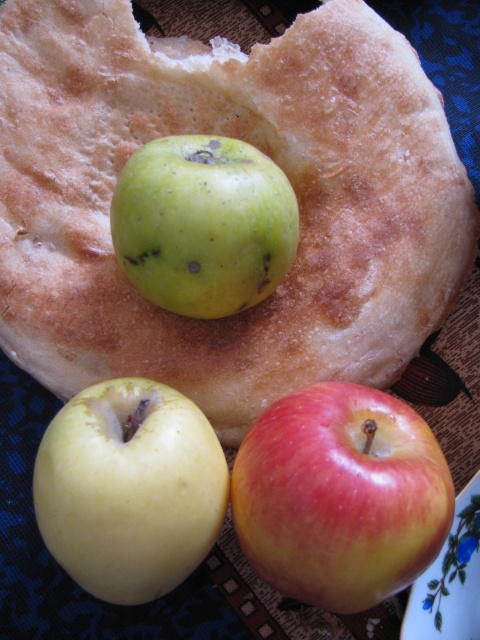
You are arranging fruits on a table and notice two green matte apples. One is labeled as the green matte apple at upper center and the other as the green matte apple at center. From the perspective of someone looking at the table, which apple is positioned to the right side?

The green matte apple at upper center is positioned to the right of the green matte apple at center.